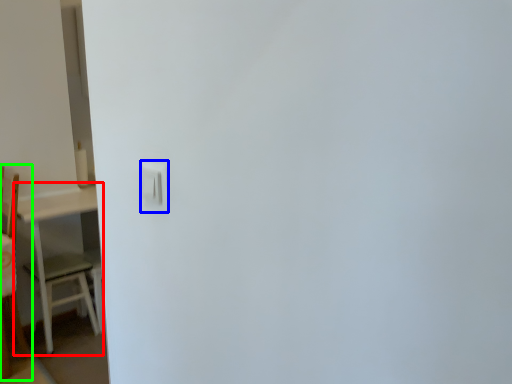
Question: Based on their relative distances, which object is nearer to table (highlighted by a red box)? Choose from light switch (highlighted by a blue box) and furniture (highlighted by a green box).

Choices:
 (A) light switch
 (B) furniture

Answer: (B)